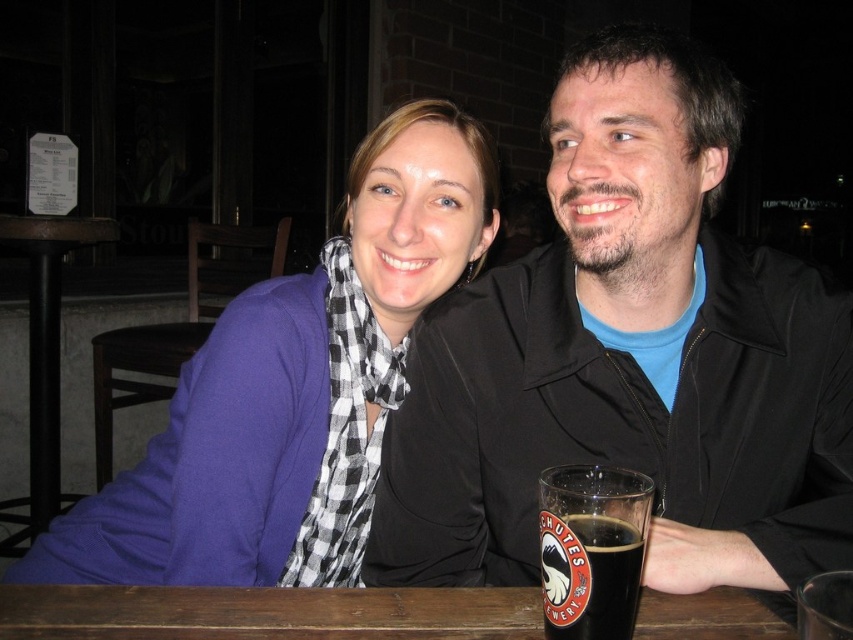
You are a photographer trying to capture a group photo of the two people at the table. Since you want to ensure both individuals are clearly visible, you need to adjust your camera angle. Considering the width of the black matte jacket at upper right and the purple soft fabric scarf at upper left, which object should you focus on to frame the shot properly?

The black matte jacket at upper right has a lesser width compared to the purple soft fabric scarf at upper left. To frame the shot properly, focus on the black matte jacket at upper right since it is narrower and requires careful positioning to ensure both individuals are visible.

You are a server at the pub and need to deliver a tray of drinks to the brown wooden table at lower center and the brown wooden table at lower left. If you start at the entrance, which table should you approach first to minimize the distance traveled?

The brown wooden table at lower center is 5.36 feet away from the brown wooden table at lower left. Since both tables are close to each other, you can choose either one first as the distance between them is minimal. However, to minimize total distance, it might be more efficient to go to the closer table first depending on their positions relative to the entrance. Without knowing the entrance location, it is hard to determine the optimal path.

You are a photographer trying to capture both the purple soft fabric scarf at upper left and the black glass mug at lower center in the same frame. Which object should you adjust your camera angle to focus on first if you want to ensure both are fully visible, considering their sizes?

The purple soft fabric scarf at upper left is wider than the black glass mug at lower center, so you should focus on the purple soft fabric scarf at upper left first to ensure its entire width fits in the frame before adjusting for the smaller mug.